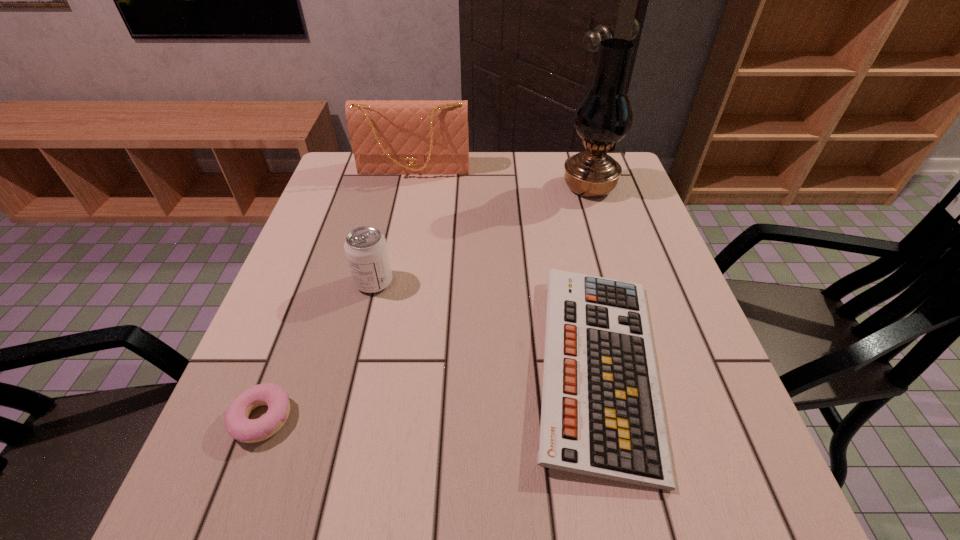
This screenshot has width=960, height=540. I want to click on object that is at the near right corner, so pyautogui.click(x=601, y=414).

Locate an element on the screen. The width and height of the screenshot is (960, 540). free location at the far edge of the desktop is located at coordinates (392, 176).

I want to click on vacant space at the near edge of the desktop, so click(444, 518).

Image resolution: width=960 pixels, height=540 pixels. In order to click on vacant space at the left edge of the desktop in this screenshot , I will do `click(335, 260)`.

In the image, there is a desktop. Identify the location of vacant space at the right edge. (591, 200).

This screenshot has width=960, height=540. In order to click on blank space at the far left corner in this screenshot , I will do pos(343,163).

What are the coordinates of `vacant space at the far right corner of the desktop` in the screenshot? It's located at (633, 197).

You are a GUI agent. You are given a task and a screenshot of the screen. Output one action in this format:
    pyautogui.click(x=<x>, y=<y>)
    Task: Click on the free space between the doughnut and the oil lamp
    
    Given the screenshot: What is the action you would take?
    pyautogui.click(x=425, y=303)

Identify the location of vacant space in between the soda can and the tallest object. (482, 234).

Locate an element on the screen. unoccupied position between the doughnut and the third tallest object is located at coordinates (318, 350).